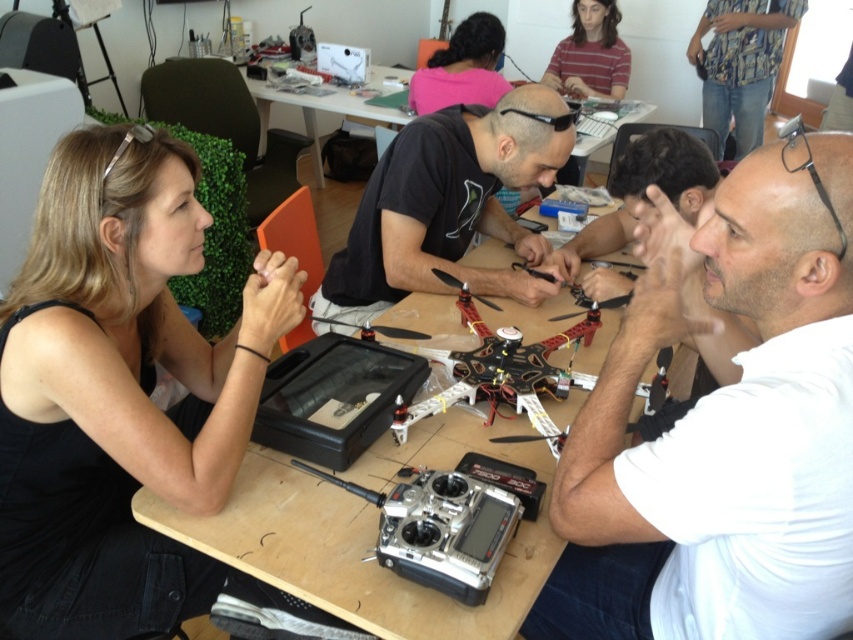
You are a technician in a workshop. You need to place a tool on the surface that is closer to you. Which surface should you choose between the black fabric at left and the matte black drone at center?

The black fabric at left is below the matte black drone at center, so the black fabric at left is closer to you. You should place the tool on the black fabric at left.

Please look at the scene described. There is a point labeled at coordinates point (119, 390). What object is located at that point?

The point (119, 390) corresponds to the black fabric at left.

From the picture: You are standing in a workshop and want to place a 36 inch long tool box on the wooden table at center. Can the tool box fit on the table without overhanging the edges?

The wooden table at center is 37.89 inches away from the camera, but this distance does not indicate the table size. Therefore, it is unclear if the tool box will fit. More information about the table dimensions is needed.